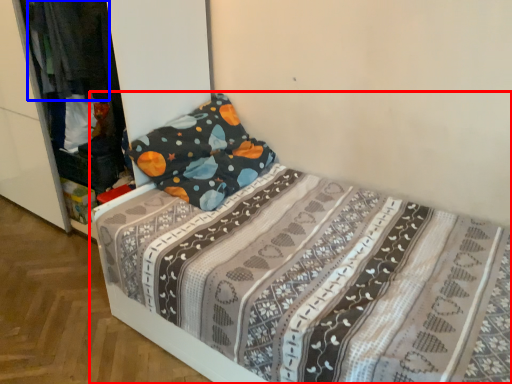
Question: Which object appears closest to the camera in this image, bed (highlighted by a red box) or clothing (highlighted by a blue box)?

Choices:
 (A) bed
 (B) clothing

Answer: (A)